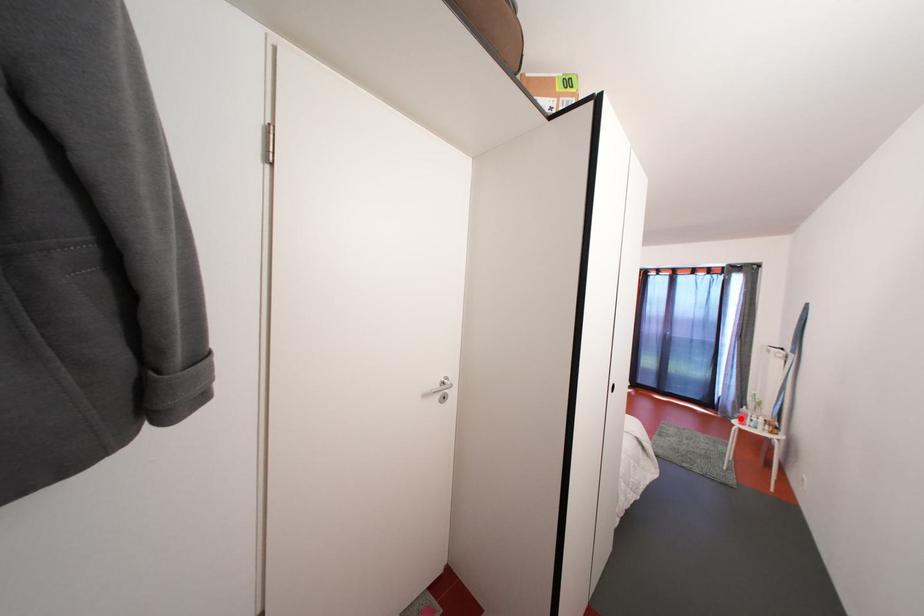
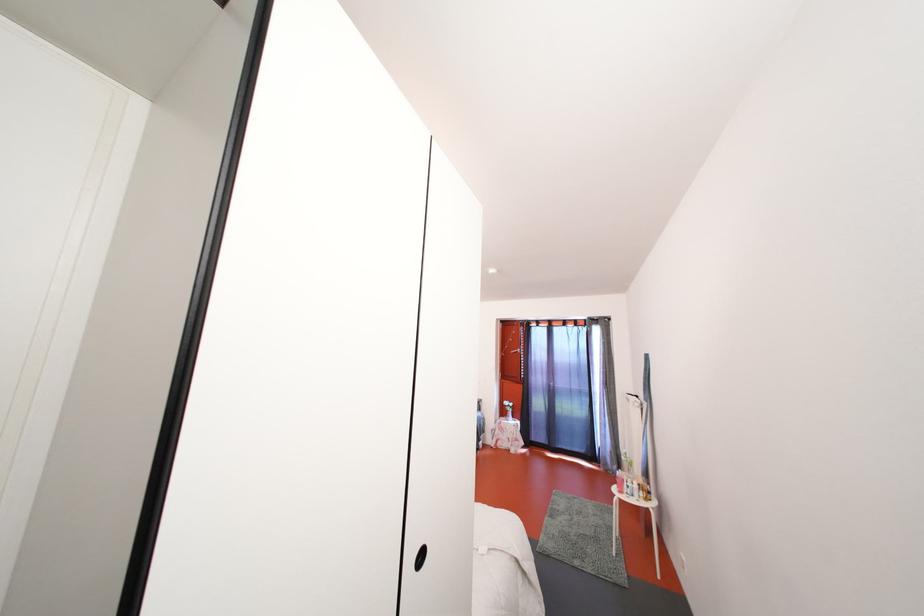
Question: A red point is marked in image1. In image2, is the corresponding 3D point closer to the camera or farther? Reply with the corresponding letter.

Choices:
 (A) The corresponding 3D point is closer.
 (B) The corresponding 3D point is farther.

Answer: (B)